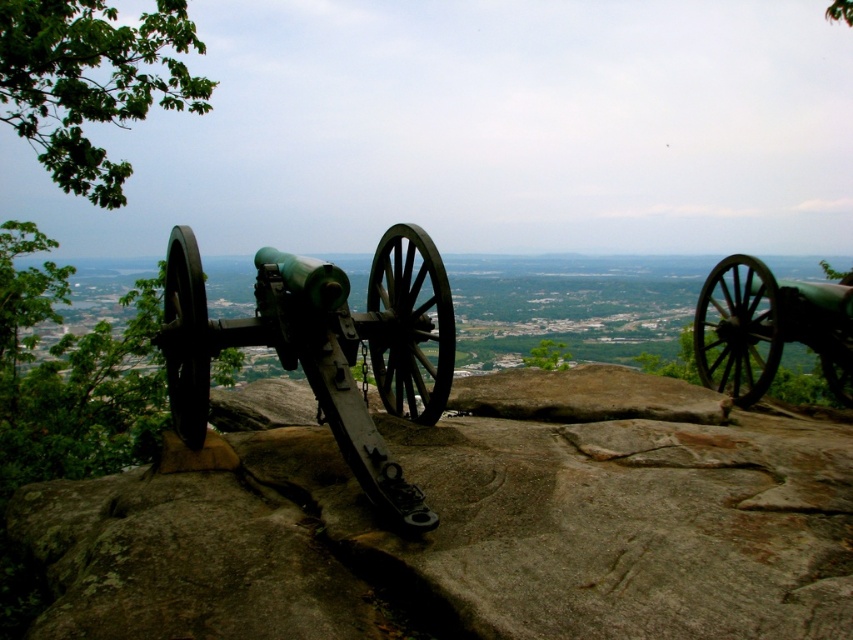
Can you confirm if smooth gray rock at center is positioned to the left of green matte cannon at center?

No, smooth gray rock at center is not to the left of green matte cannon at center.

Between point (131, 556) and point (389, 484), which one is positioned behind?

The point (389, 484) is more distant.

I want to click on smooth gray rock at center, so click(463, 536).

Which is more to the left, smooth gray rock at center or green matte cannon at right?

From the viewer's perspective, smooth gray rock at center appears more on the left side.

What do you see at coordinates (463, 536) in the screenshot?
I see `smooth gray rock at center` at bounding box center [463, 536].

Describe the element at coordinates (463, 536) in the screenshot. I see `smooth gray rock at center` at that location.

Where is `smooth gray rock at center`? This screenshot has height=640, width=853. smooth gray rock at center is located at coordinates (463, 536).

What do you see at coordinates (321, 348) in the screenshot? This screenshot has height=640, width=853. I see `green matte cannon at center` at bounding box center [321, 348].

Is green matte cannon at center closer to camera compared to green matte cannon at right?

Yes, it is.

Does point (338, 396) come closer to viewer compared to point (741, 385)?

Yes, point (338, 396) is closer to viewer.

Identify the location of green matte cannon at center. (321, 348).